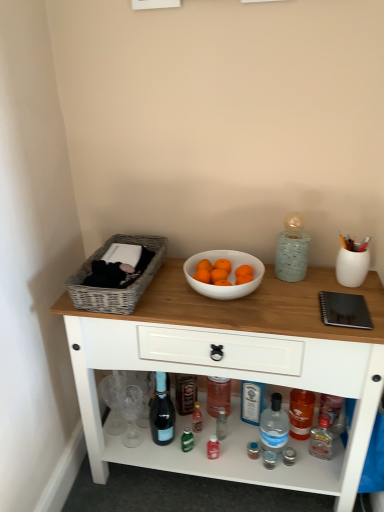
Identify the location of vacant area that is situated to the right of woven gray basket at left. Image resolution: width=384 pixels, height=512 pixels. (188, 293).